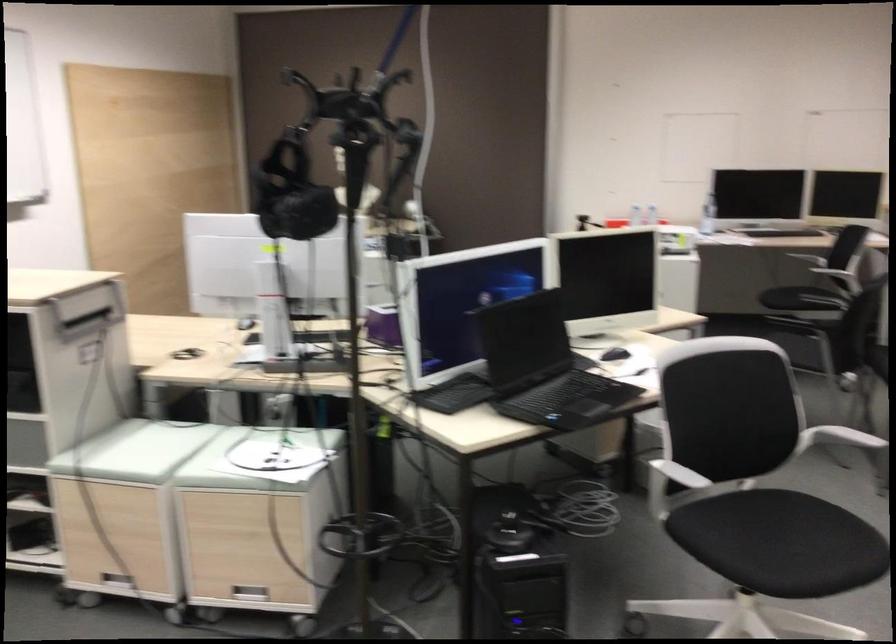
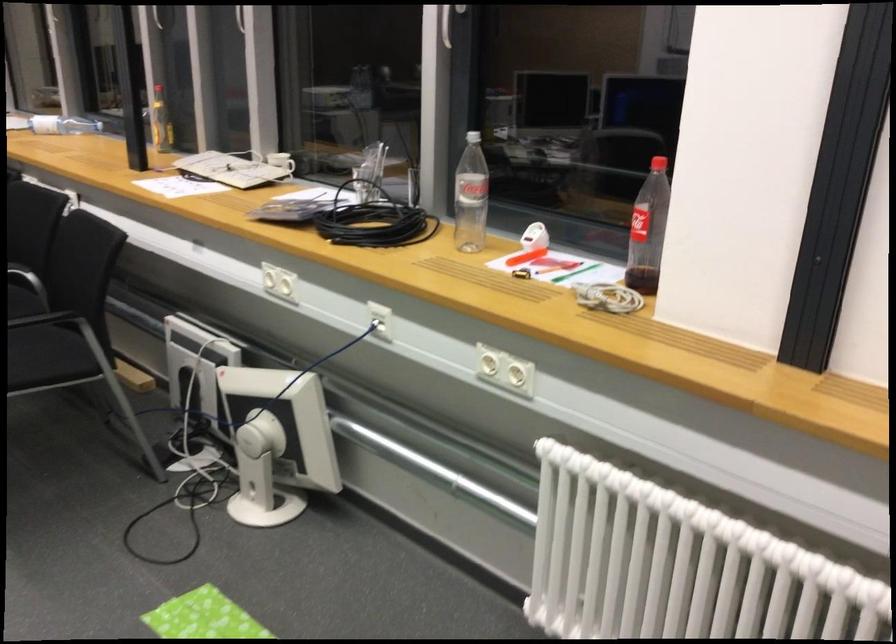
Question: How did the camera likely rotate?

Choices:
 (A) Left
 (B) Right
 (C) Up
 (D) Down

Answer: (B)